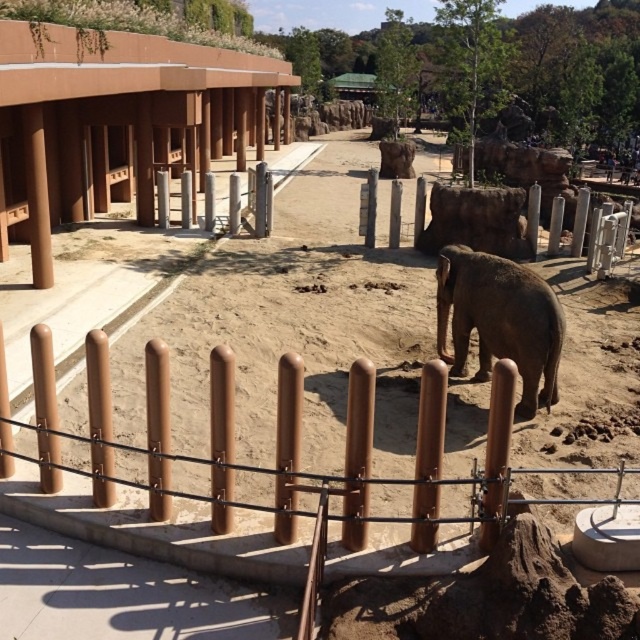
Question: Considering the relative positions of brown matte fence at center and gray matte elephant at center in the image provided, where is brown matte fence at center located with respect to gray matte elephant at center?

Choices:
 (A) right
 (B) left

Answer: (B)

Question: Is brown matte fence at center bigger than gray matte elephant at center?

Choices:
 (A) no
 (B) yes

Answer: (B)

Question: Among these objects, which one is nearest to the camera?

Choices:
 (A) gray matte elephant at center
 (B) brown matte fence at center

Answer: (B)

Question: Which point appears closest to the camera in this image?

Choices:
 (A) (509, 269)
 (B) (291, 440)

Answer: (B)

Question: Which point is farther to the camera?

Choices:
 (A) (504, 310)
 (B) (356, 540)

Answer: (A)

Question: Does brown matte fence at center have a lesser width compared to gray matte elephant at center?

Choices:
 (A) yes
 (B) no

Answer: (B)